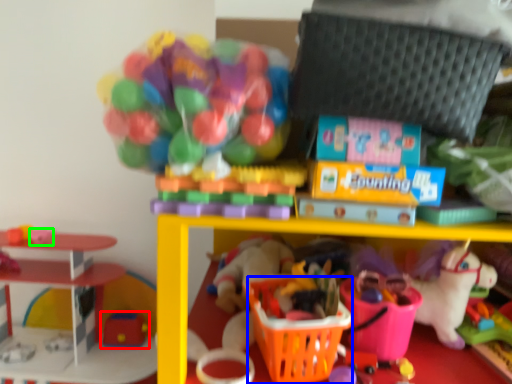
Question: Which object is the closest to the toy (highlighted by a red box)? Choose among these: basket (highlighted by a blue box) or toy (highlighted by a green box).

Choices:
 (A) basket
 (B) toy

Answer: (B)